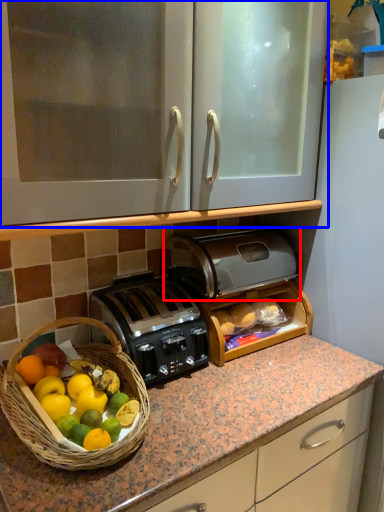
Question: Which object appears closest to the camera in this image, toaster (highlighted by a red box) or cabinetry (highlighted by a blue box)?

Choices:
 (A) toaster
 (B) cabinetry

Answer: (B)